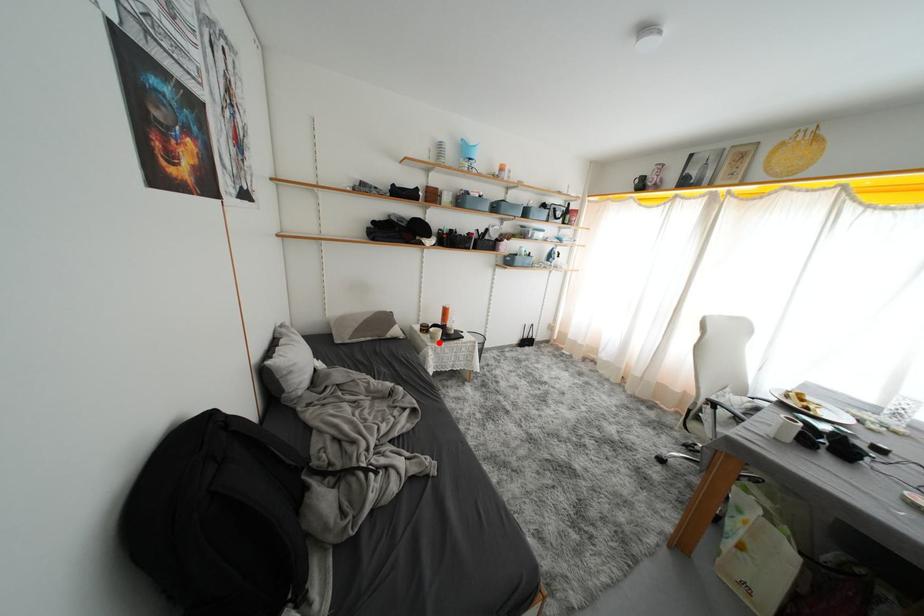
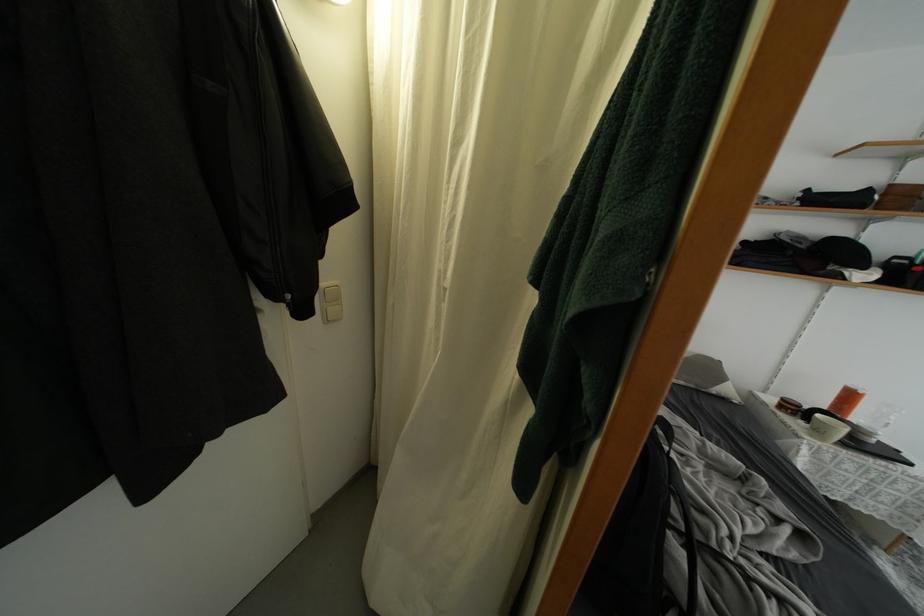
Question: I am providing you with two images of the same scene from different viewpoints. In image1, a red point is highlighted. Considering the same 3D point in image2, which of the following is correct?

Choices:
 (A) It is closer
 (B) It is farther

Answer: (A)